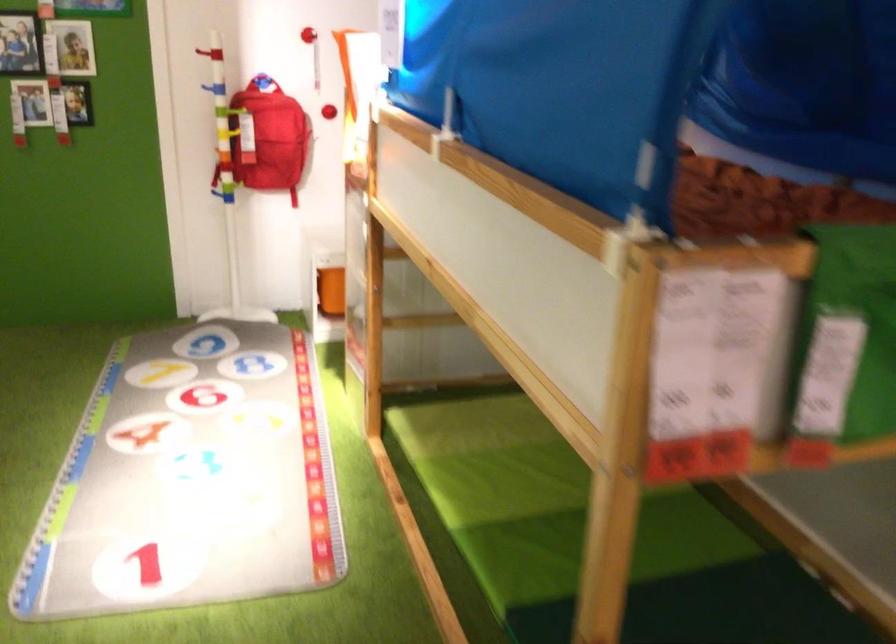
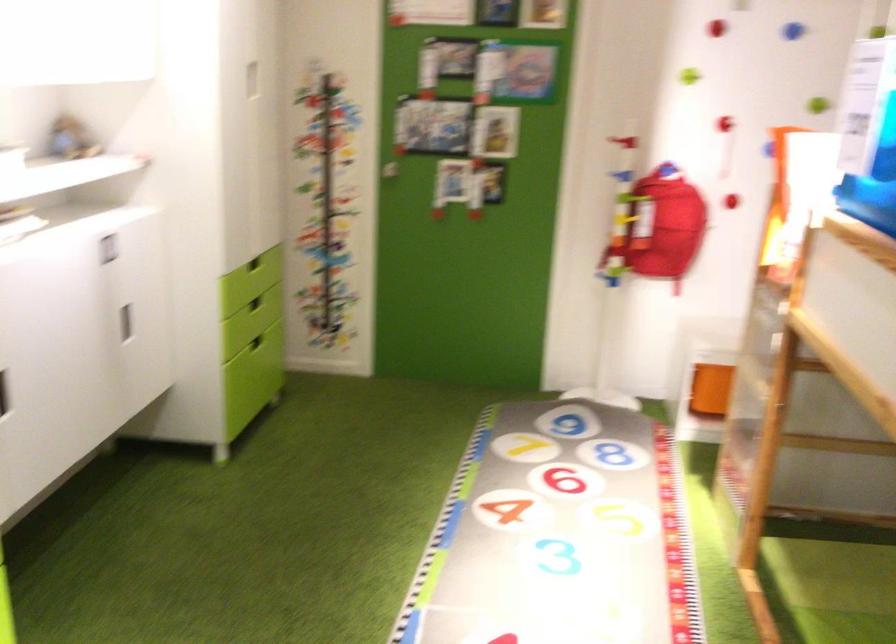
The point at (328, 289) is marked in the first image. Where is the corresponding point in the second image?

(710, 389)